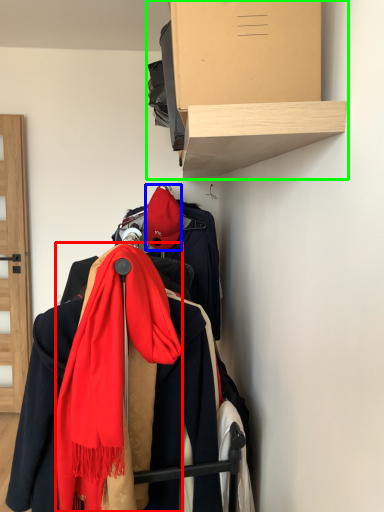
Question: Estimate the real-world distances between objects in this image. Which object is closer to scarf (highlighted by a red box), hat (highlighted by a blue box) or shelf (highlighted by a green box)?

Choices:
 (A) hat
 (B) shelf

Answer: (B)